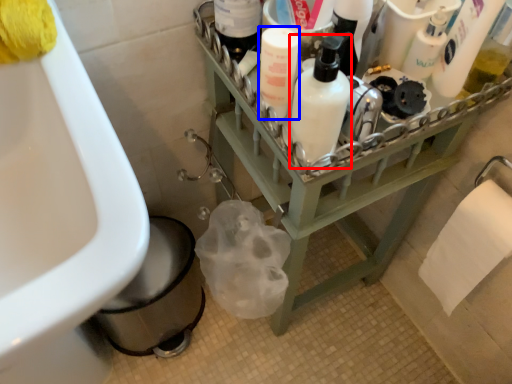
Question: Which object appears farthest to the camera in this image, cleaning product (highlighted by a red box) or cleaning product (highlighted by a blue box)?

Choices:
 (A) cleaning product
 (B) cleaning product

Answer: (B)